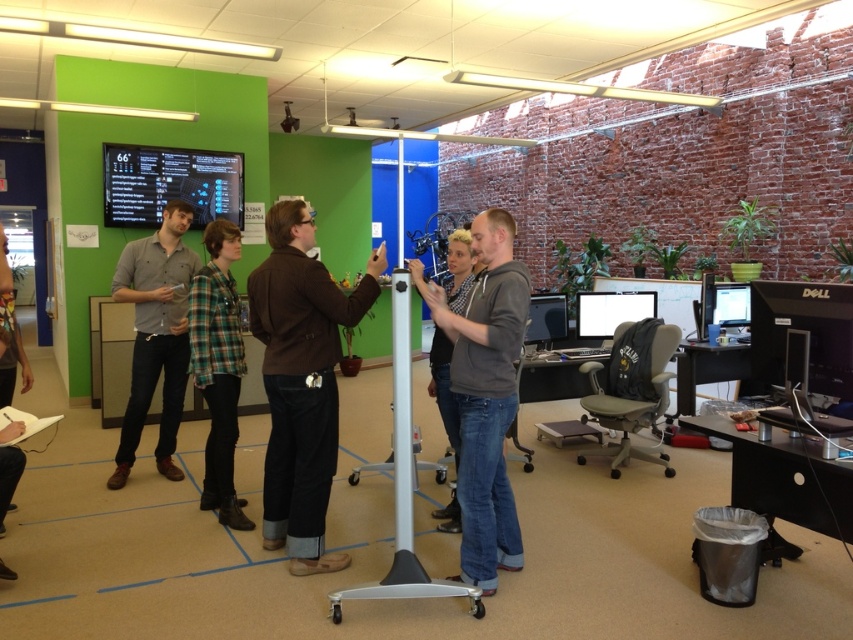
You are standing at the white, wheeled stand with a cylindrical top in the modern office. You need to walk to a point that is behind the stand. Which of the two points, point (212, 364) or point (607, 330), should you go to?

You should go to point (607, 330) because point (212, 364) is in front of point (607, 330), meaning point (607, 330) is behind the stand.

You are a visitor in the office and need to determine which object is taller between the brown leather jacket at center and the white glossy monitor at center right. Based on the scene, which one is taller?

The brown leather jacket at center is taller than the white glossy monitor at center right according to the description.